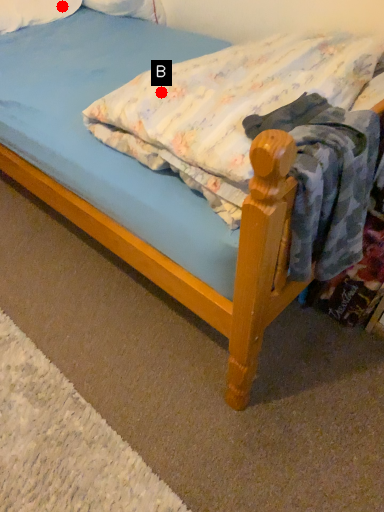
Question: Two points are circled on the image, labeled by A and B beside each circle. Which point is farther from the camera taking this photo?

Choices:
 (A) A is further
 (B) B is further

Answer: (A)